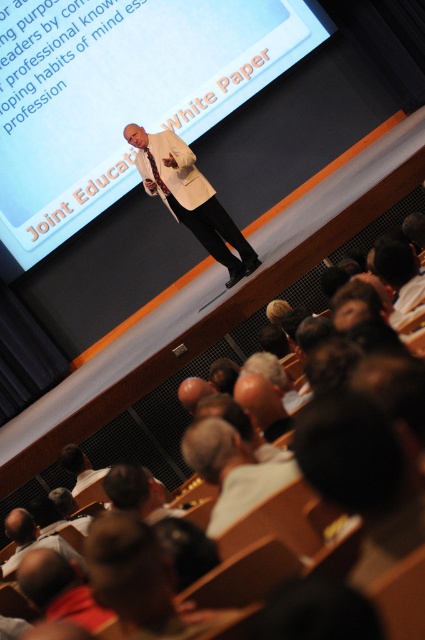
You are an event coordinator planning to place a podium for the presenter. The stage has a coordinate system where the bottom left corner is the origin. The presenter is wearing a white matte jacket at center. Where should you place the podium to ensure it is directly in front of the presenter?

The podium should be placed at the same x coordinate as the white matte jacket at center, which is 0.309, to ensure it is directly in front of him along the stage.

You are a stagehand who needs to move a microphone stand from the white matte shirt at center to the white matte shirt at lower left. The stand is 1.8 meters wide. Will it fit in the space between them?

The distance between the white matte shirt at center and the white matte shirt at lower left is 2.12 meters. Since the microphone stand is 1.8 meters wide, it will fit in the space between them as the distance is greater than the stand width.